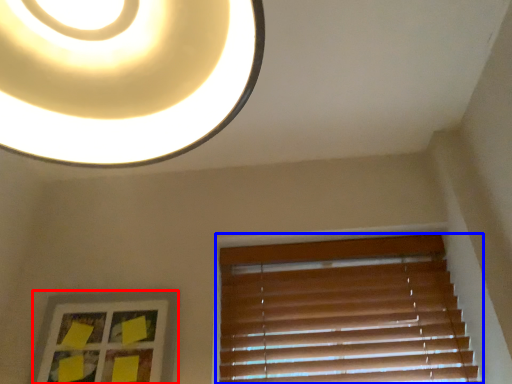
Question: Which of the following is the farthest to the observer, picture frame (highlighted by a red box) or window blind (highlighted by a blue box)?

Choices:
 (A) picture frame
 (B) window blind

Answer: (B)